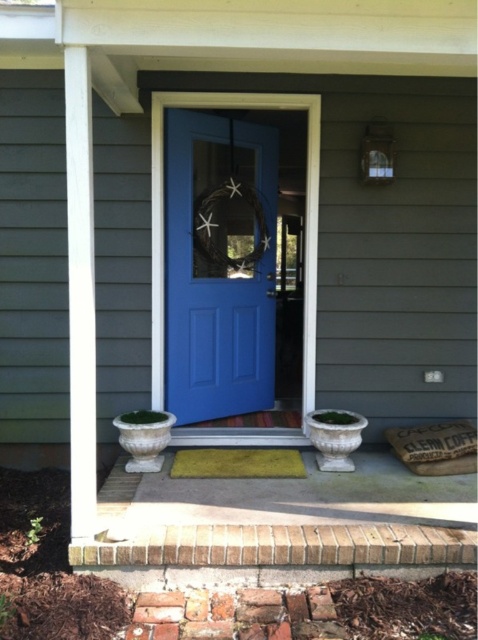
Who is positioned more to the left, matte blue door at center or yellow textured mat at center?

From the viewer's perspective, matte blue door at center appears more on the left side.

Is point (249, 403) behind point (232, 449)?

Yes, point (249, 403) is farther from viewer.

Where is `matte blue door at center`? Image resolution: width=478 pixels, height=640 pixels. matte blue door at center is located at coordinates (218, 266).